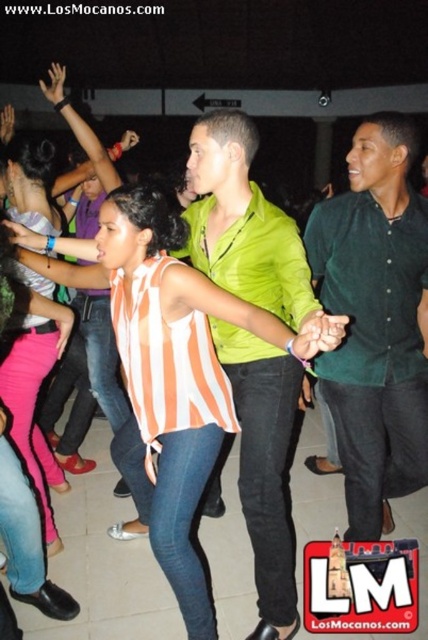
You are a photographer at the dance event and want to capture a photo of both the green matte shirt at center and the striped fabric shirt at center. Which shirt should you focus on to ensure both are in sharp focus?

The green matte shirt at center is closer to the viewer than the striped fabric shirt at center. To ensure both are in sharp focus, you should focus on the green matte shirt at center since it is closer, and adjust the depth of field accordingly.